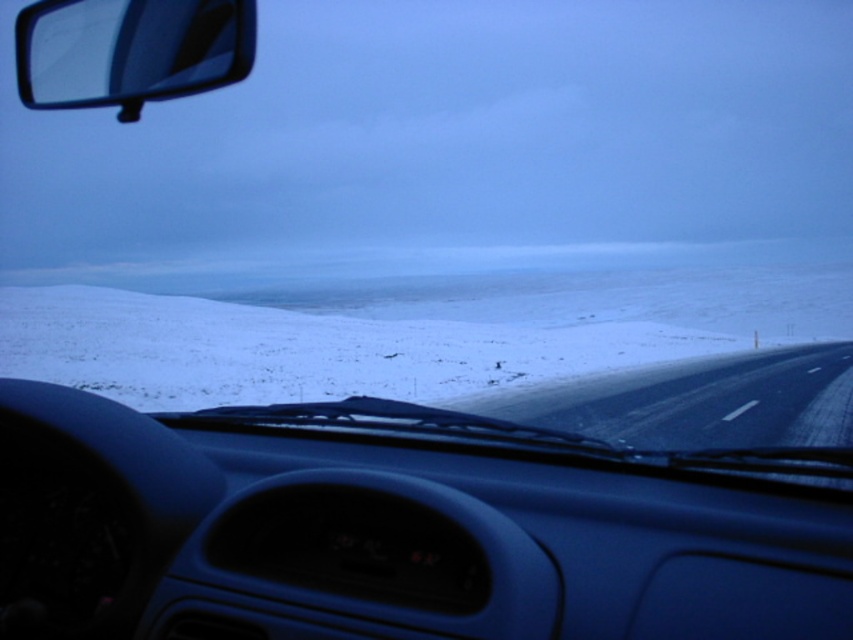
Between point (838, 305) and point (32, 10), which one is positioned in front?

Positioned in front is point (32, 10).

Is white powdery snow at center below transparent glass side mirror at upper left?

Yes, white powdery snow at center is below transparent glass side mirror at upper left.

The image size is (853, 640). Describe the element at coordinates (405, 332) in the screenshot. I see `white powdery snow at center` at that location.

You are a GUI agent. You are given a task and a screenshot of the screen. Output one action in this format:
    pyautogui.click(x=<x>, y=<y>)
    Task: Click on the white powdery snow at center
    The image size is (853, 640).
    Given the screenshot: What is the action you would take?
    pyautogui.click(x=405, y=332)